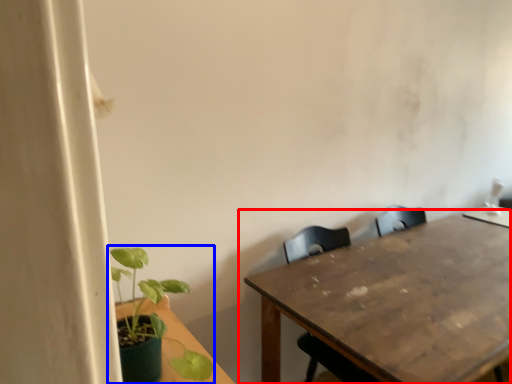
Question: Which point is further to the camera, table (highlighted by a red box) or houseplant (highlighted by a blue box)?

Choices:
 (A) table
 (B) houseplant

Answer: (A)